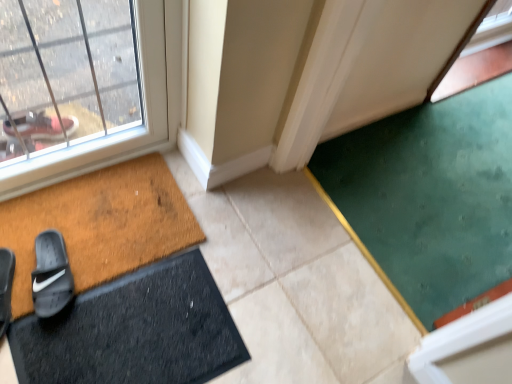
The width and height of the screenshot is (512, 384). In order to click on black rubber slide at lower left, which is the second footwear in left-to-right order in this screenshot , I will do `click(51, 275)`.

The height and width of the screenshot is (384, 512). What do you see at coordinates (6, 287) in the screenshot? I see `black suede slide at lower left, the 1th footwear viewed from the left` at bounding box center [6, 287].

Measure the distance between point (501,78) and camera.

Point (501,78) is 7.16 feet away from camera.

I want to click on black rubber slide at lower left, positioned as the first footwear in right-to-left order, so click(x=51, y=275).

Would you say black rubber slide at lower left, positioned as the first footwear in right-to-left order, contains black suede slide at lower left, acting as the second footwear starting from the right?

No, black suede slide at lower left, acting as the second footwear starting from the right, is located outside of black rubber slide at lower left, positioned as the first footwear in right-to-left order.

Is black rubber slide at lower left, which is the second footwear in left-to-right order, turned away from black suede slide at lower left, acting as the second footwear starting from the right?

No, black rubber slide at lower left, which is the second footwear in left-to-right order, is not facing the opposite direction of black suede slide at lower left, acting as the second footwear starting from the right.

Which object is wider, black rubber slide at lower left, which is the second footwear in left-to-right order, or black suede slide at lower left, the 1th footwear viewed from the left?

With larger width is black suede slide at lower left, the 1th footwear viewed from the left.

Is black rubber slide at lower left, positioned as the first footwear in right-to-left order, positioned in front of black suede slide at lower left, the 1th footwear viewed from the left?

No, black rubber slide at lower left, positioned as the first footwear in right-to-left order, is further to the viewer.

Choose the correct answer: Is black suede slide at lower left, the 1th footwear viewed from the left, inside black rubber bath mat at lower left, which is the second bath mat in top-to-bottom order, or outside it?

black suede slide at lower left, the 1th footwear viewed from the left, is outside black rubber bath mat at lower left, which is the second bath mat in top-to-bottom order.

In terms of height, does black suede slide at lower left, the 1th footwear viewed from the left, look taller or shorter compared to black rubber bath mat at lower left, positioned as the first bath mat in bottom-to-top order?

black suede slide at lower left, the 1th footwear viewed from the left, is taller than black rubber bath mat at lower left, positioned as the first bath mat in bottom-to-top order.

Considering the sizes of objects black suede slide at lower left, the 1th footwear viewed from the left, and black rubber bath mat at lower left, which is the second bath mat in top-to-bottom order, in the image provided, who is smaller, black suede slide at lower left, the 1th footwear viewed from the left, or black rubber bath mat at lower left, which is the second bath mat in top-to-bottom order,?

Smaller between the two is black suede slide at lower left, the 1th footwear viewed from the left.

Considering the positions of objects black rubber bath mat at lower left, which is the second bath mat in top-to-bottom order, and black suede slide at lower left, acting as the second footwear starting from the right, in the image provided, who is more to the left, black rubber bath mat at lower left, which is the second bath mat in top-to-bottom order, or black suede slide at lower left, acting as the second footwear starting from the right,?

black suede slide at lower left, acting as the second footwear starting from the right.

Consider the image. Which point is more forward, (172, 369) or (7, 263)?

The point (172, 369) is closer.

Is black rubber bath mat at lower left, positioned as the first bath mat in bottom-to-top order, situated inside black suede slide at lower left, the 1th footwear viewed from the left, or outside?

black rubber bath mat at lower left, positioned as the first bath mat in bottom-to-top order, is not enclosed by black suede slide at lower left, the 1th footwear viewed from the left.

Is black rubber bath mat at lower left, which is the second bath mat in top-to-bottom order, taller or shorter than black suede slide at lower left, the 1th footwear viewed from the left?

Clearly, black rubber bath mat at lower left, which is the second bath mat in top-to-bottom order, is shorter compared to black suede slide at lower left, the 1th footwear viewed from the left.

From the image's perspective, which one is positioned higher, black suede slide at lower left, acting as the second footwear starting from the right, or green carpet at lower right?

green carpet at lower right.

Based on the photo, would you say black suede slide at lower left, acting as the second footwear starting from the right, is inside or outside green carpet at lower right?

black suede slide at lower left, acting as the second footwear starting from the right, is outside green carpet at lower right.

Considering the sizes of objects black suede slide at lower left, acting as the second footwear starting from the right, and green carpet at lower right in the image provided, who is bigger, black suede slide at lower left, acting as the second footwear starting from the right, or green carpet at lower right?

With larger size is green carpet at lower right.

Is black suede slide at lower left, the 1th footwear viewed from the left, looking in the opposite direction of green carpet at lower right?

That's not correct — black suede slide at lower left, the 1th footwear viewed from the left, is not looking away from green carpet at lower right.

Considering the sizes of objects black rubber slide at lower left, which is the second footwear in left-to-right order, and black rubber bath mat at lower left, which is the second bath mat in top-to-bottom order, in the image provided, who is taller, black rubber slide at lower left, which is the second footwear in left-to-right order, or black rubber bath mat at lower left, which is the second bath mat in top-to-bottom order,?

black rubber slide at lower left, which is the second footwear in left-to-right order.

From a real-world perspective, who is located higher, black rubber slide at lower left, positioned as the first footwear in right-to-left order, or black rubber bath mat at lower left, which is the second bath mat in top-to-bottom order?

black rubber slide at lower left, positioned as the first footwear in right-to-left order.

From the image's perspective, who appears lower, black rubber slide at lower left, which is the second footwear in left-to-right order, or black rubber bath mat at lower left, positioned as the first bath mat in bottom-to-top order?

black rubber bath mat at lower left, positioned as the first bath mat in bottom-to-top order, from the image's perspective.

Does green carpet at lower right appear on the right side of black rubber bath mat at lower left, which is the second bath mat in top-to-bottom order?

Correct, you'll find green carpet at lower right to the right of black rubber bath mat at lower left, which is the second bath mat in top-to-bottom order.

Where is `doormat behind the black rubber bath mat at lower left, which is the second bath mat in top-to-bottom order`? The image size is (512, 384). doormat behind the black rubber bath mat at lower left, which is the second bath mat in top-to-bottom order is located at coordinates (430, 200).

Which is in front, green carpet at lower right or black rubber bath mat at lower left, which is the second bath mat in top-to-bottom order?

black rubber bath mat at lower left, which is the second bath mat in top-to-bottom order.

What's the angular difference between green carpet at lower right and black rubber bath mat at lower left, which is the second bath mat in top-to-bottom order,'s facing directions?

The angular difference between green carpet at lower right and black rubber bath mat at lower left, which is the second bath mat in top-to-bottom order, is 2.15 degrees.

Between black rubber slide at lower left, which is the second footwear in left-to-right order, and brown textured doormat at lower left, which appears as the 1th bath mat when viewed from the top, which one has larger size?

brown textured doormat at lower left, which appears as the 1th bath mat when viewed from the top, is bigger.

Can you confirm if black rubber slide at lower left, positioned as the first footwear in right-to-left order, is positioned to the left of brown textured doormat at lower left, which appears as the 1th bath mat when viewed from the top?

Correct, you'll find black rubber slide at lower left, positioned as the first footwear in right-to-left order, to the left of brown textured doormat at lower left, which appears as the 1th bath mat when viewed from the top.

Considering the relative sizes of black rubber slide at lower left, which is the second footwear in left-to-right order, and brown textured doormat at lower left, which ranks as the second bath mat in bottom-to-top order, in the image provided, is black rubber slide at lower left, which is the second footwear in left-to-right order, thinner than brown textured doormat at lower left, which ranks as the second bath mat in bottom-to-top order,?

Yes.

Is black rubber slide at lower left, which is the second footwear in left-to-right order, looking in the opposite direction of brown textured doormat at lower left, which appears as the 1th bath mat when viewed from the top?

Yes.

Image resolution: width=512 pixels, height=384 pixels. What are the coordinates of `footwear located on the right of black suede slide at lower left, the 1th footwear viewed from the left` in the screenshot? It's located at (51, 275).

Where is `the 1st footwear positioned above the black rubber bath mat at lower left, which is the second bath mat in top-to-bottom order (from the image's perspective)`? The height and width of the screenshot is (384, 512). the 1st footwear positioned above the black rubber bath mat at lower left, which is the second bath mat in top-to-bottom order (from the image's perspective) is located at coordinates (6, 287).

From the image, which object appears to be nearer to black suede slide at lower left, the 1th footwear viewed from the left, black rubber bath mat at lower left, which is the second bath mat in top-to-bottom order, or brown textured doormat at lower left, which appears as the 1th bath mat when viewed from the top?

Among the two, brown textured doormat at lower left, which appears as the 1th bath mat when viewed from the top, is located nearer to black suede slide at lower left, the 1th footwear viewed from the left.

Which object lies further to the anchor point brown textured doormat at lower left, which appears as the 1th bath mat when viewed from the top, green carpet at lower right or black rubber bath mat at lower left, positioned as the first bath mat in bottom-to-top order?

Based on the image, green carpet at lower right appears to be further to brown textured doormat at lower left, which appears as the 1th bath mat when viewed from the top.

Looking at the image, which one is located closer to black suede slide at lower left, the 1th footwear viewed from the left, black rubber bath mat at lower left, positioned as the first bath mat in bottom-to-top order, or black rubber slide at lower left, positioned as the first footwear in right-to-left order?

Based on the image, black rubber slide at lower left, positioned as the first footwear in right-to-left order, appears to be nearer to black suede slide at lower left, the 1th footwear viewed from the left.

Based on their spatial positions, is black rubber slide at lower left, which is the second footwear in left-to-right order, or black suede slide at lower left, the 1th footwear viewed from the left, further from green carpet at lower right?

The object further to green carpet at lower right is black suede slide at lower left, the 1th footwear viewed from the left.

Estimate the real-world distances between objects in this image. Which object is closer to black rubber bath mat at lower left, which is the second bath mat in top-to-bottom order, green carpet at lower right or black rubber slide at lower left, which is the second footwear in left-to-right order?

black rubber slide at lower left, which is the second footwear in left-to-right order, is positioned closer to the anchor black rubber bath mat at lower left, which is the second bath mat in top-to-bottom order.

Looking at the image, which one is located further to black suede slide at lower left, acting as the second footwear starting from the right, black rubber slide at lower left, positioned as the first footwear in right-to-left order, or green carpet at lower right?

green carpet at lower right is further to black suede slide at lower left, acting as the second footwear starting from the right.

Looking at the image, which one is located closer to brown textured doormat at lower left, which ranks as the second bath mat in bottom-to-top order, green carpet at lower right or black rubber slide at lower left, positioned as the first footwear in right-to-left order?

black rubber slide at lower left, positioned as the first footwear in right-to-left order, is positioned closer to the anchor brown textured doormat at lower left, which ranks as the second bath mat in bottom-to-top order.

Which object lies further to the anchor point black rubber bath mat at lower left, which is the second bath mat in top-to-bottom order, brown textured doormat at lower left, which appears as the 1th bath mat when viewed from the top, or black rubber slide at lower left, which is the second footwear in left-to-right order?

The object further to black rubber bath mat at lower left, which is the second bath mat in top-to-bottom order, is black rubber slide at lower left, which is the second footwear in left-to-right order.

Locate an element on the screen. Image resolution: width=512 pixels, height=384 pixels. bath mat between brown textured doormat at lower left, which appears as the 1th bath mat when viewed from the top, and green carpet at lower right is located at coordinates (134, 331).

This screenshot has height=384, width=512. I want to click on footwear between black suede slide at lower left, the 1th footwear viewed from the left, and green carpet at lower right, in the horizontal direction, so click(51, 275).

The image size is (512, 384). In order to click on bath mat between black suede slide at lower left, the 1th footwear viewed from the left, and black rubber bath mat at lower left, positioned as the first bath mat in bottom-to-top order, from left to right in this screenshot , I will do `click(100, 224)`.

This screenshot has height=384, width=512. In order to click on footwear between black suede slide at lower left, the 1th footwear viewed from the left, and brown textured doormat at lower left, which ranks as the second bath mat in bottom-to-top order in this screenshot , I will do `click(51, 275)`.